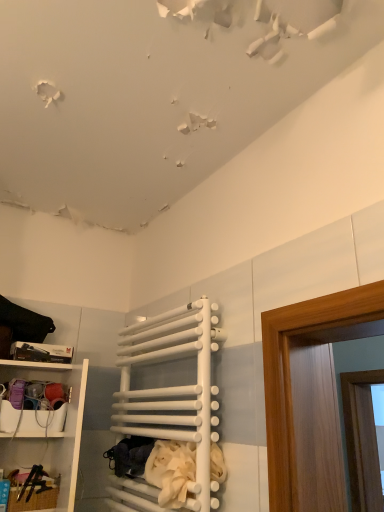
Question: Is white plastic shelf at lower left situated inside white matte towel rack at center or outside?

Choices:
 (A) inside
 (B) outside

Answer: (B)

Question: Relative to white matte towel rack at center, is white plastic shelf at lower left in front or behind?

Choices:
 (A) front
 (B) behind

Answer: (B)

Question: Considering the real-world distances, which object is closest to the white plastic shelf at lower left?

Choices:
 (A) beige fabric laundry at lower center
 (B) white matte towel rack at center

Answer: (B)

Question: Which object is the closest to the white matte towel rack at center?

Choices:
 (A) beige fabric laundry at lower center
 (B) white plastic shelf at lower left

Answer: (A)